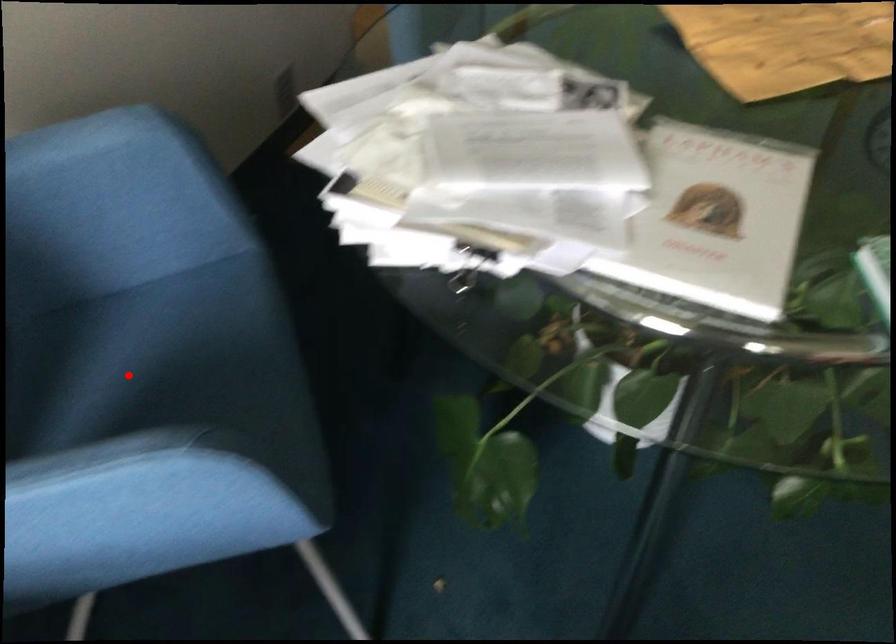
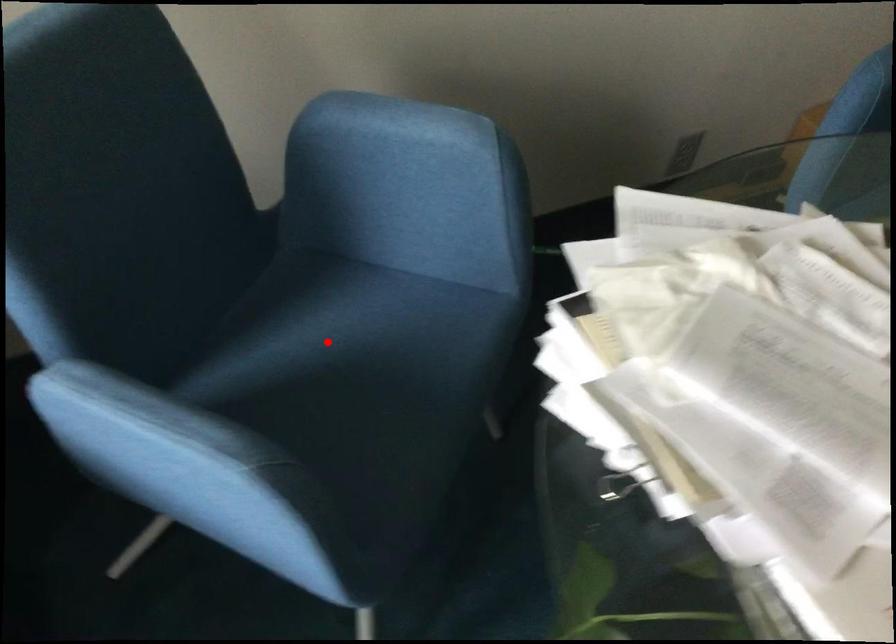
I am providing you with two images of the same scene from different viewpoints. A red point is marked on the first image and another point is marked on the second image. Is the marked point in image1 the same physical position as the marked point in image2?

Yes